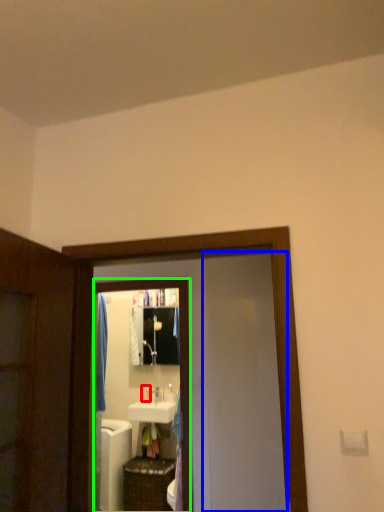
Question: Which object is the farthest from toiletry (highlighted by a red box)? Choose among these: screen door (highlighted by a blue box) or mirror (highlighted by a green box).

Choices:
 (A) screen door
 (B) mirror

Answer: (A)